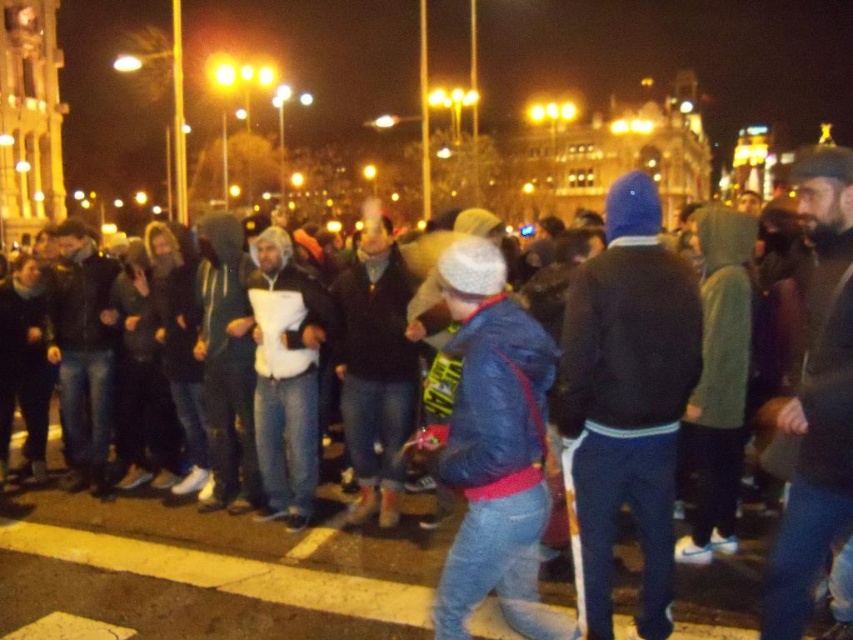
Who is more distant from viewer, (492, 481) or (302, 355)?

Positioned behind is point (302, 355).

Between blue leather jacket at center and white matte hoodie at center, which one is positioned higher?

Positioned higher is white matte hoodie at center.

Is point (463, 320) positioned after point (276, 428)?

No.

Image resolution: width=853 pixels, height=640 pixels. In order to click on blue leather jacket at center in this screenshot , I will do `click(494, 449)`.

Does dark brown sweater at center appear on the left side of blue leather jacket at center?

In fact, dark brown sweater at center is to the right of blue leather jacket at center.

Which is more to the right, dark brown sweater at center or blue leather jacket at center?

From the viewer's perspective, dark brown sweater at center appears more on the right side.

You are a GUI agent. You are given a task and a screenshot of the screen. Output one action in this format:
    pyautogui.click(x=<x>, y=<y>)
    Task: Click on the dark brown sweater at center
    The height and width of the screenshot is (640, 853).
    Given the screenshot: What is the action you would take?
    pyautogui.click(x=625, y=403)

How far apart are dark brown sweater at center and white matte hoodie at center?

A distance of 17.06 meters exists between dark brown sweater at center and white matte hoodie at center.

Which is more to the right, dark brown sweater at center or white matte hoodie at center?

dark brown sweater at center is more to the right.

Is point (653, 604) closer to camera compared to point (316, 435)?

Yes, it is in front of point (316, 435).

Locate an element on the screen. dark brown sweater at center is located at coordinates (625, 403).